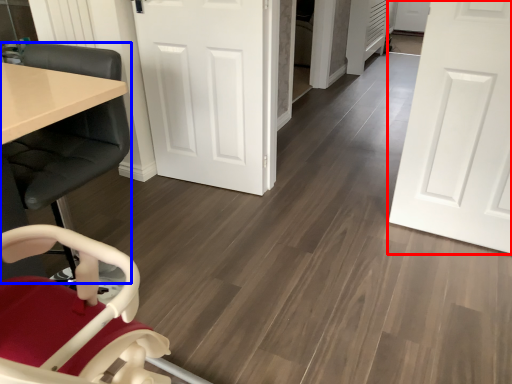
Question: Which object is closer to the camera taking this photo, door (highlighted by a red box) or chair (highlighted by a blue box)?

Choices:
 (A) door
 (B) chair

Answer: (B)